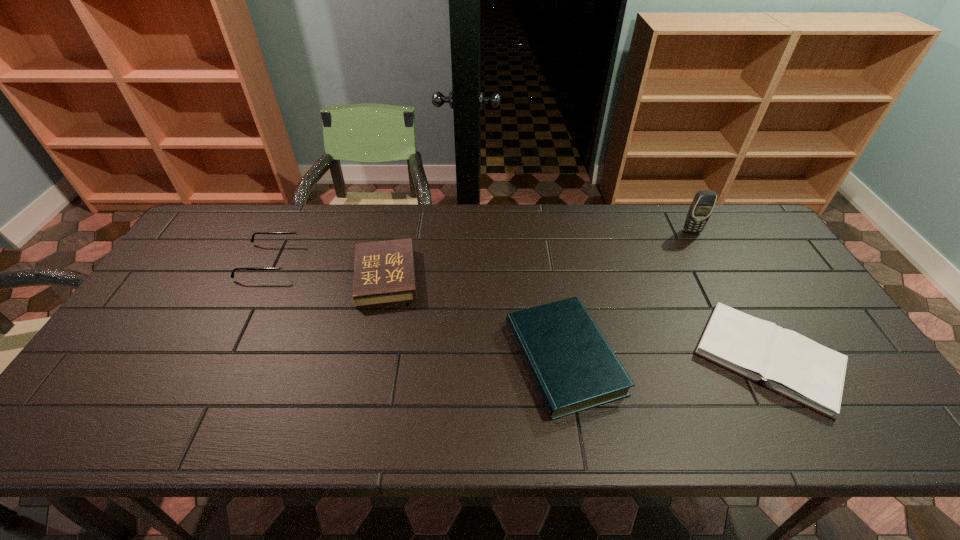
At what (x,y) coordinates should I click in order to perform the action: click on free area in between the spectacles and the second object from left to right. Please return your answer as a coordinate pair (x, y). Image resolution: width=960 pixels, height=540 pixels. Looking at the image, I should click on (328, 269).

At what (x,y) coordinates should I click in order to perform the action: click on free space between the second hardback book from right to left and the second object from left to right. Please return your answer as a coordinate pair (x, y). Looking at the image, I should click on (475, 318).

Locate which object ranks in proximity to the second hardback book from left to right. Please provide its 2D coordinates. Your answer should be formatted as a tuple, i.e. [(x, y)], where the tuple contains the x and y coordinates of a point satisfying the conditions above.

[(789, 364)]

Select which object is the second closest to the shortest hardback book. Please provide its 2D coordinates. Your answer should be formatted as a tuple, i.e. [(x, y)], where the tuple contains the x and y coordinates of a point satisfying the conditions above.

[(703, 203)]

Select which hardback book is the closest to the shortest object. Please provide its 2D coordinates. Your answer should be formatted as a tuple, i.e. [(x, y)], where the tuple contains the x and y coordinates of a point satisfying the conditions above.

[(572, 366)]

Point out which hardback book is positioned as the second nearest to the leftmost hardback book. Please provide its 2D coordinates. Your answer should be formatted as a tuple, i.e. [(x, y)], where the tuple contains the x and y coordinates of a point satisfying the conditions above.

[(789, 364)]

The width and height of the screenshot is (960, 540). I want to click on vacant area in the image that satisfies the following two spatial constraints: 1. at the hinge ends of the spectacles; 2. on the left side of the second hardback book from right to left, so click(223, 358).

I want to click on vacant position in the image that satisfies the following two spatial constraints: 1. at the hinge ends of the leftmost object; 2. on the back side of the shortest object, so click(x=223, y=357).

The width and height of the screenshot is (960, 540). In order to click on blank area in the image that satisfies the following two spatial constraints: 1. at the hinge ends of the rightmost hardback book; 2. on the left side of the leftmost object in this screenshot , I will do `click(223, 357)`.

In order to click on vacant point that satisfies the following two spatial constraints: 1. on the front face of the tallest object; 2. on the left side of the rightmost hardback book in this screenshot , I will do 759,357.